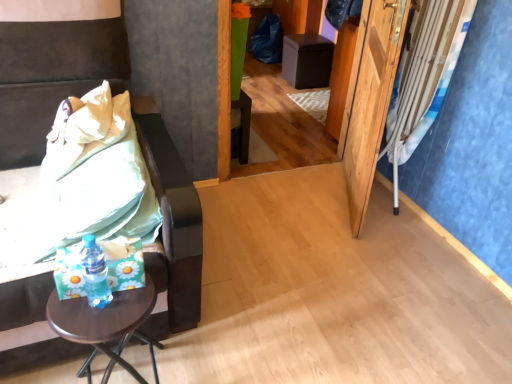
In order to click on vacant space in front of translucent plastic bottle at lower left in this screenshot , I will do `click(95, 326)`.